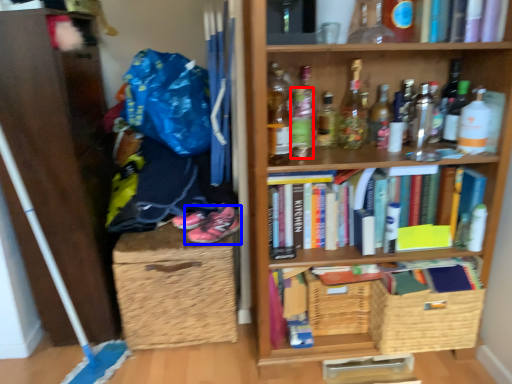
Question: Which of the following is the closest to the observer, bottle (highlighted by a red box) or footwear (highlighted by a blue box)?

Choices:
 (A) bottle
 (B) footwear

Answer: (A)